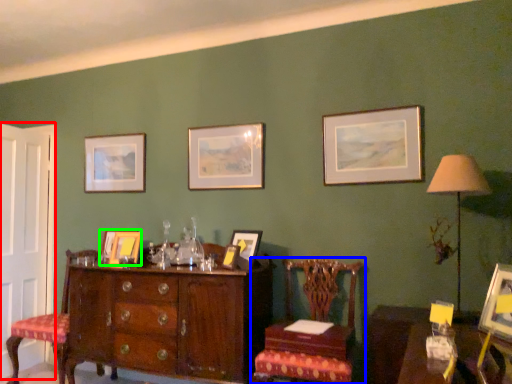
Question: Which object is positioned closest to door (highlighted by a red box)? Select from chair (highlighted by a blue box) and picture frame (highlighted by a green box).

Choices:
 (A) chair
 (B) picture frame

Answer: (B)